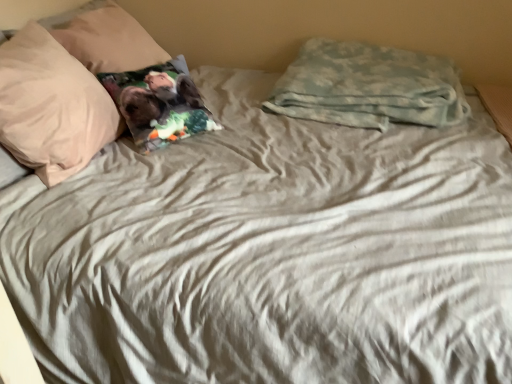
Question: Is printed fabric pillow at left, the 3th pillow positioned from the right, inside or outside of beige soft pillow at upper left, which is the fourth pillow in right-to-left order?

Choices:
 (A) outside
 (B) inside

Answer: (A)

Question: Considering the relative positions of printed fabric pillow at left, the 3th pillow positioned from the right, and beige soft pillow at upper left, arranged as the 1th pillow when viewed from the left, in the image provided, is printed fabric pillow at left, the 3th pillow positioned from the right, to the left or to the right of beige soft pillow at upper left, arranged as the 1th pillow when viewed from the left,?

Choices:
 (A) left
 (B) right

Answer: (B)

Question: Which object is the closest to the printed fabric pillow at upper left, which is counted as the 3th pillow, starting from the left?

Choices:
 (A) printed fabric pillow at left, the 3th pillow positioned from the right
 (B) camouflage fabric pillow at upper right, which is the first pillow from right to left
 (C) beige soft pillow at upper left, arranged as the 1th pillow when viewed from the left

Answer: (A)

Question: Which of these objects is positioned closest to the camouflage fabric pillow at upper right, the 4th pillow in the left-to-right sequence?

Choices:
 (A) beige soft pillow at upper left, arranged as the 1th pillow when viewed from the left
 (B) printed fabric pillow at left, the second pillow when ordered from left to right
 (C) printed fabric pillow at upper left, the 2th pillow positioned from the right

Answer: (C)